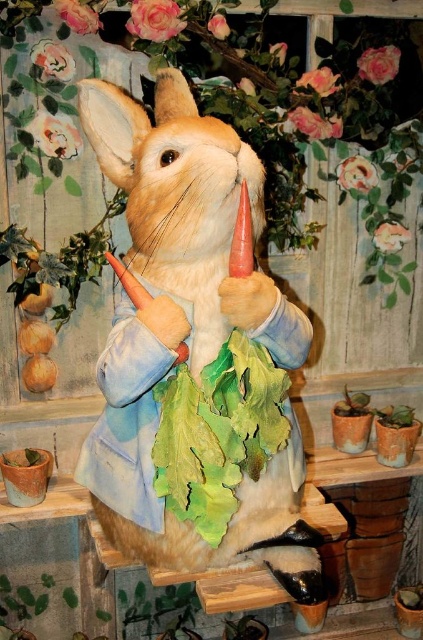
You are a gardener who wants to place a new small potted plant between the fuzzy beige rabbit at center and the green leafy plant at lower center. Considering their sizes, which object should the potted plant be closer to?

The fuzzy beige rabbit at center is larger in size than the green leafy plant at lower center, so the potted plant should be placed closer to the smaller green leafy plant at lower center to maintain visual balance.

You are a gardener who needs to place a new flower pot between the fuzzy beige rabbit at center and the green leafy plant at lower center. Considering their heights, which object should the flower pot be placed closer to in order to ensure it doesn

The fuzzy beige rabbit at center is much taller than the green leafy plant at lower center. Therefore, the flower pot should be placed closer to the green leafy plant at lower center to maintain visual balance between the two objects.

You are standing in front of the rabbit statue and want to place two decorative stones at the exact locations of point (145,294) and point (252,616). Which point will require you to walk further back to place the stone?

Point (252,616) is further away from the viewer than point (145,294), so you will need to walk further back to place the stone at point (252,616).